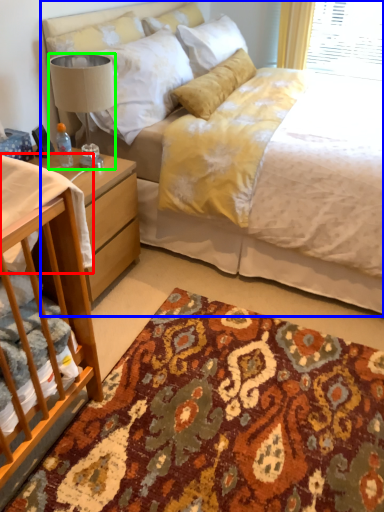
Question: Which object is positioned closest to sheet (highlighted by a red box)? Select from bed (highlighted by a blue box) and lamp (highlighted by a green box).

Choices:
 (A) bed
 (B) lamp

Answer: (B)